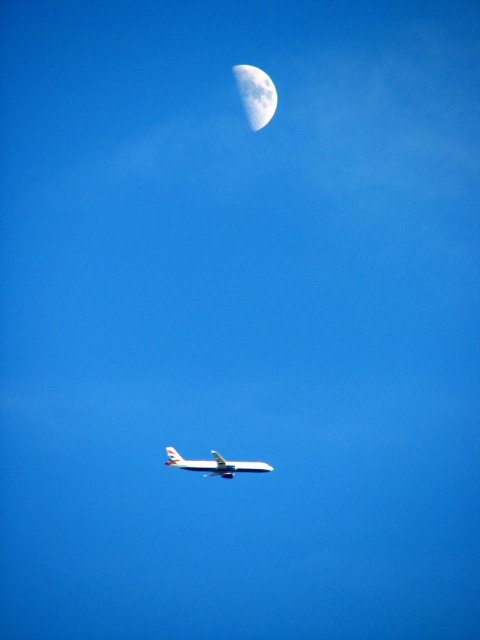
You are an astronaut floating in space and see the silver metallic moon at upper center and the white matte airplane at center. Which object is narrower in width?

The silver metallic moon at upper center is thinner than the white matte airplane at center, so the silver metallic moon at upper center is narrower in width.

You are a pilot flying the white matte airplane at center. You notice the silver metallic moon at upper center in the sky. Can you determine if the moon is positioned above or below your airplane?

The silver metallic moon at upper center is above the white matte airplane at center, so the moon is positioned above the airplane.

Based on the photo, you are an astronaut floating in space and see the silver metallic moon at upper center and the white matte airplane at center. Which object is positioned to the right side of the other?

The silver metallic moon at upper center is positioned to the right of the white matte airplane at center.